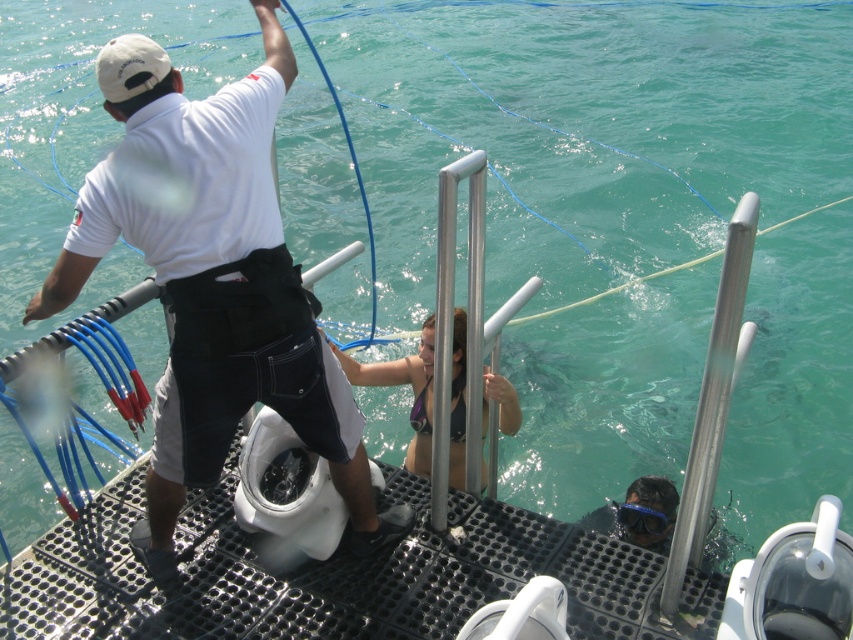
What is the 2D coordinate of the white matte sailor at upper left in the image?

The white matte sailor at upper left is located at the 2D coordinate point of (x=213, y=282).

In the scene shown: You are a photographer on the boat deck and want to capture both the white matte sailor at upper left and the matte black bikini at center in the same frame. Which object should you focus on first to ensure both are in focus?

You should focus on the white matte sailor at upper left first because it is closer to you than the matte black bikini at center, so focusing on the closer object ensures both will be in focus.

You are standing on the diving platform and see the white matte sailor at upper left and the matte black bikini at center. Which object is positioned higher from the water surface?

The white matte sailor at upper left is located above the matte black bikini at center, so it is positioned higher from the water surface.